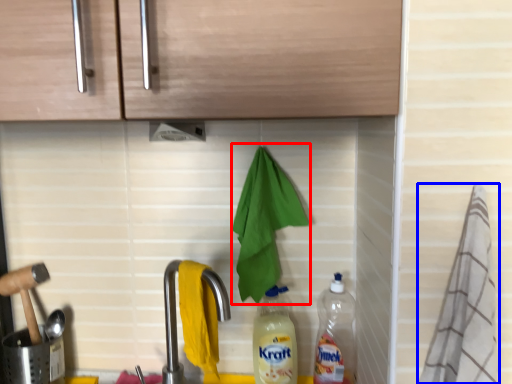
Question: Among these objects, which one is nearest to the camera, hand towel (highlighted by a red box) or material (highlighted by a blue box)?

Choices:
 (A) hand towel
 (B) material

Answer: (B)